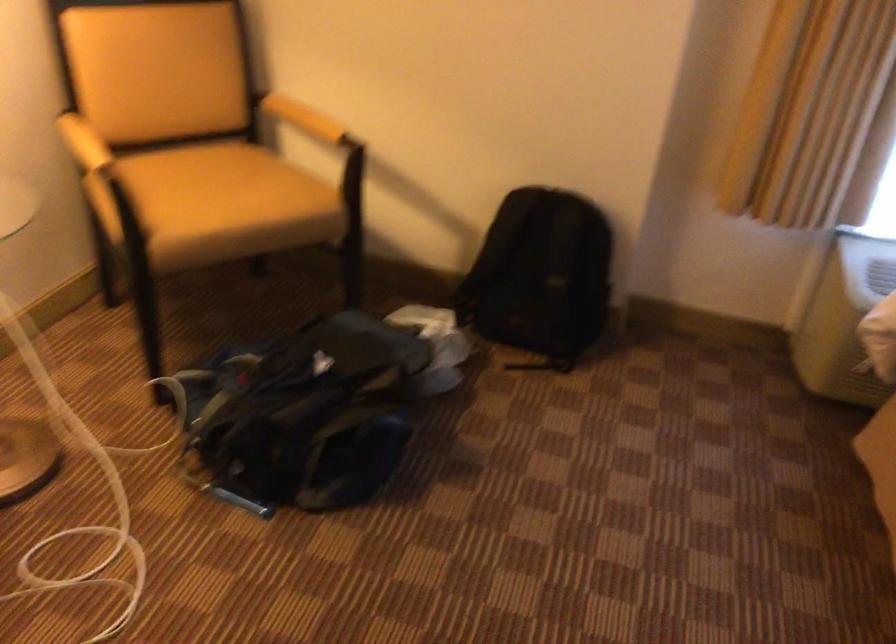
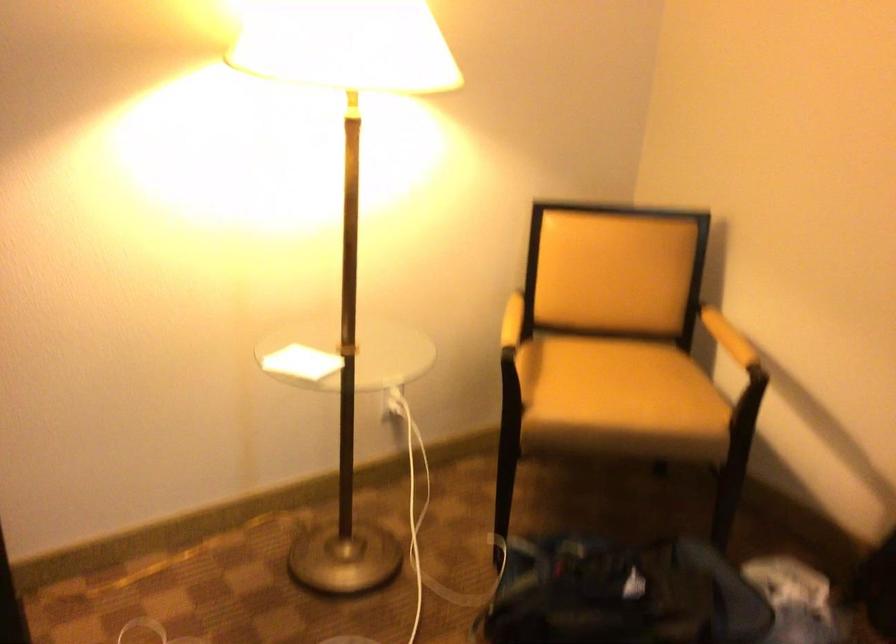
Question: How did the camera likely rotate?

Choices:
 (A) Left
 (B) Right
 (C) Up
 (D) Down

Answer: (A)